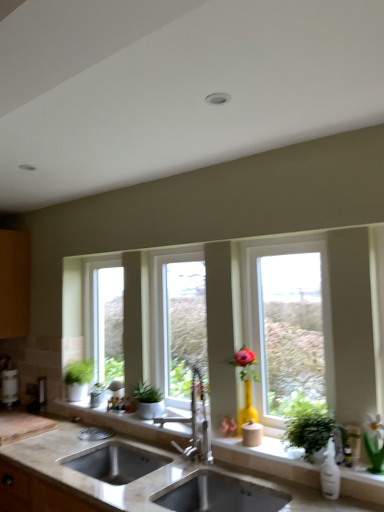
Where is `vacant space situated on the left part of green matte flowerpot at left`? vacant space situated on the left part of green matte flowerpot at left is located at coordinates (77, 407).